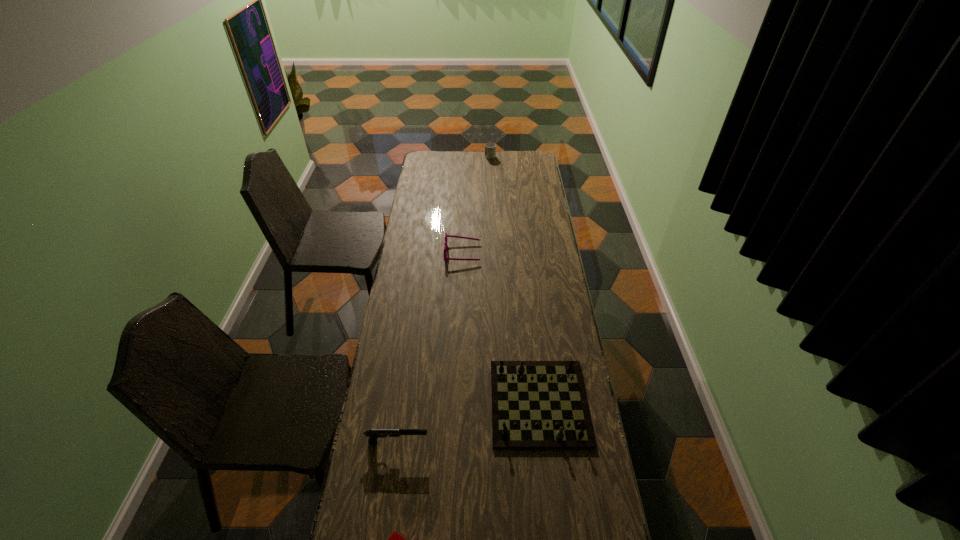
I want to click on object positioned at the right edge, so click(x=535, y=404).

This screenshot has height=540, width=960. Find the location of `vacant region at the far edge of the desktop`. vacant region at the far edge of the desktop is located at coordinates point(501,151).

In the image, there is a desktop. Where is `vacant space at the left edge`? The height and width of the screenshot is (540, 960). vacant space at the left edge is located at coordinates (430, 178).

Identify the location of blank space at the right edge. (524, 205).

At what (x,y) coordinates should I click in order to perform the action: click on vacant space at the far left corner. Please return your answer as a coordinate pair (x, y). This screenshot has width=960, height=540. Looking at the image, I should click on (424, 165).

In the image, there is a desktop. Where is `vacant space at the far right corner`? This screenshot has height=540, width=960. vacant space at the far right corner is located at coordinates (518, 151).

Identify the location of free space between the cup and the chessboard. (515, 279).

You are a GUI agent. You are given a task and a screenshot of the screen. Output one action in this format:
    pyautogui.click(x=<x>, y=<y>)
    Task: Click on the vacant area that lies between the chessboard and the cup
    This screenshot has width=960, height=540.
    Given the screenshot: What is the action you would take?
    click(515, 279)

Identify the location of free space between the chessboard and the cup. Image resolution: width=960 pixels, height=540 pixels. 515,279.

The image size is (960, 540). Find the location of `free space between the second farthest object and the chessboard`. free space between the second farthest object and the chessboard is located at coordinates (501, 328).